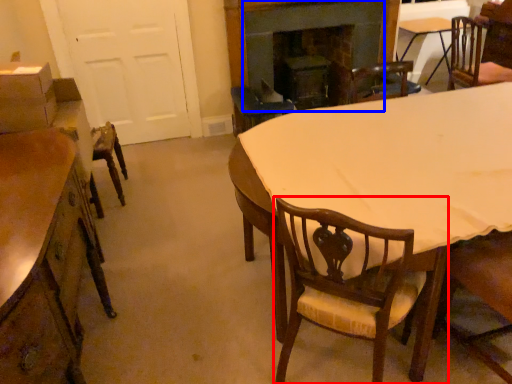
Question: Which of the following is the closest to the observer, chair (highlighted by a red box) or fireplace (highlighted by a blue box)?

Choices:
 (A) chair
 (B) fireplace

Answer: (A)